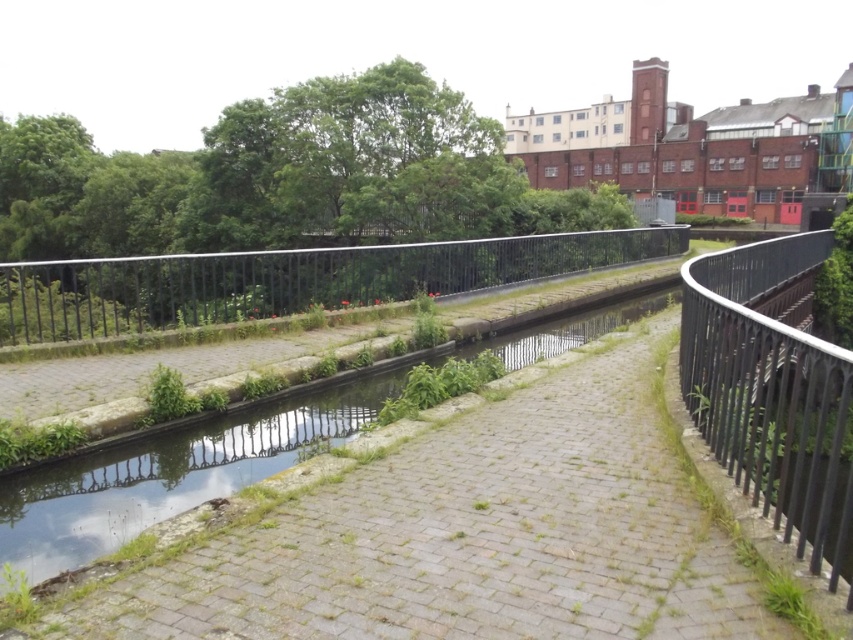
You are a delivery robot that needs to navigate from the starting point to the end of the brick paved path at center. The black metal fence at center is in your way. Can you go around it by moving to the right side of the path?

The brick paved path at center is closer to the viewer than the black metal fence at center, so you can go around the black metal fence at center by moving to the right side of the brick paved path at center.

You are a delivery robot with a 3.5 feet wide package. You need to move along the brick paved path at center. Can you safely navigate the path without crossing the metal railings or the grassy embankment?

The brick paved path at center is 10.27 feet away from the viewer. Since the robot with a 3.5 feet wide package needs to navigate the path, the distance provided does not indicate the path width. Therefore, it is unclear if the path is wide enough for the robot to move safely without crossing boundaries.

You are a delivery drone flying over the canal scene. You need to land on the black metal fence at right but must avoid the black metal fence at center. Given the distance between them, is it possible to safely land on the target fence without getting too close to the other one?

The black metal fence at right is 12.59 meters away from the black metal fence at center. Since the distance is significant, the drone can safely land on the black metal fence at right while maintaining a safe distance from the black metal fence at center.